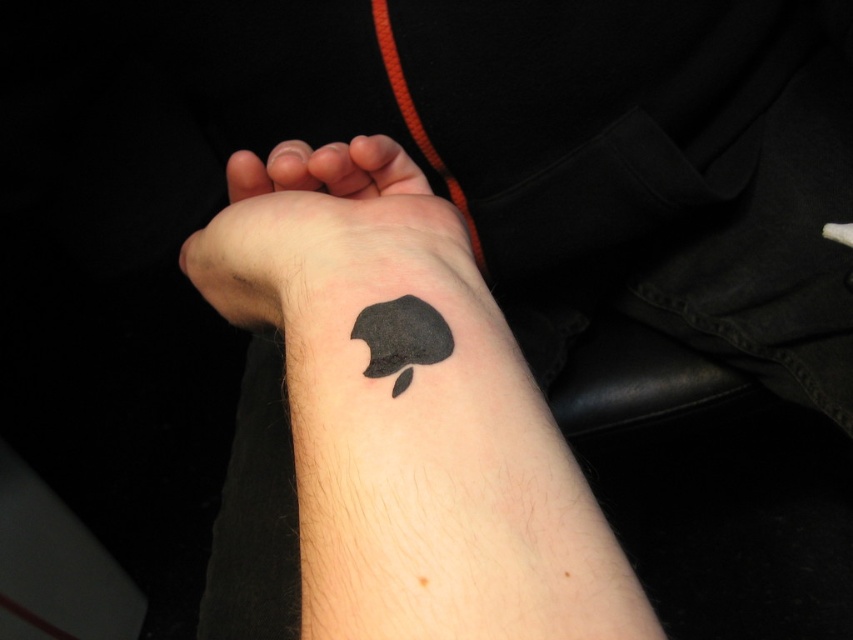
You are a tattoo artist who needs to place a new tattoo between the black matte tattoo at lower center and the black matte apple at lower center. The minimum distance required between tattoos is 3 inches. Can you fit another tattoo in this space?

The distance between the black matte tattoo at lower center and the black matte apple at lower center is 2.63 inches, which is less than the required 3 inches. Therefore, you cannot fit another tattoo in this space.

You are a tattoo artist working on a client whose arm is shown in the image. The client wants to add a new tattoo near the existing black matte tattoo at lower center. The new tattoo must be placed at coordinates that are exactly 2 cm to the right and 1 cm above the current tattoo. What are the new coordinates where the new tattoo should be placed?

The new coordinates for the new tattoo would be calculated by adding 2 cm to the x coordinate and subtracting 1 cm from the y coordinate of the existing black matte tattoo at lower center. Since the original position is at point (408, 416), the new coordinates would be approximately 0.650 plus 2 cm and 0.479 minus 1 cm. However, without knowing the total width and height of the image in centimeters, we cannot provide exact coordinates in cm. The question might be better phrased in terms of relative pixel